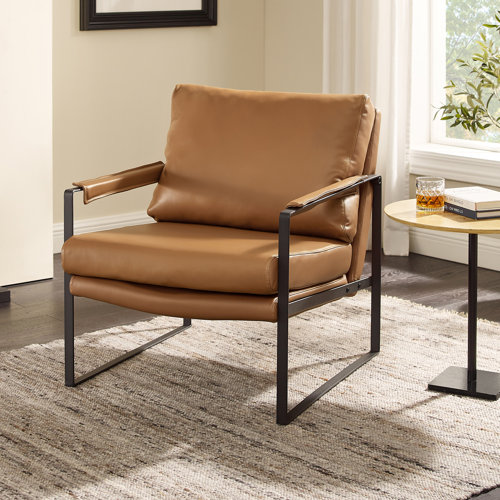
This screenshot has width=500, height=500. In order to click on metal chair frame in this screenshot , I will do `click(68, 207)`, `click(131, 353)`, `click(313, 394)`, `click(337, 291)`, `click(281, 238)`.